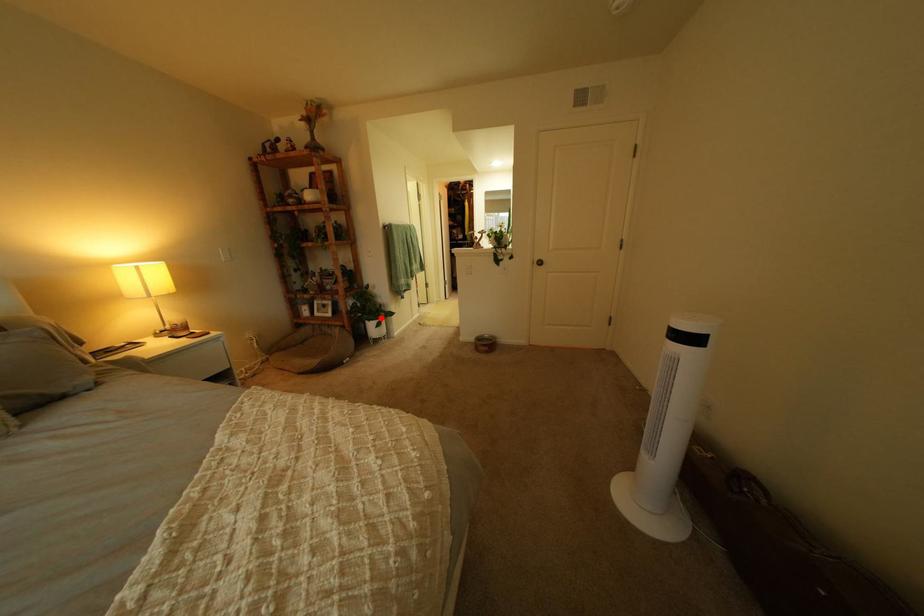
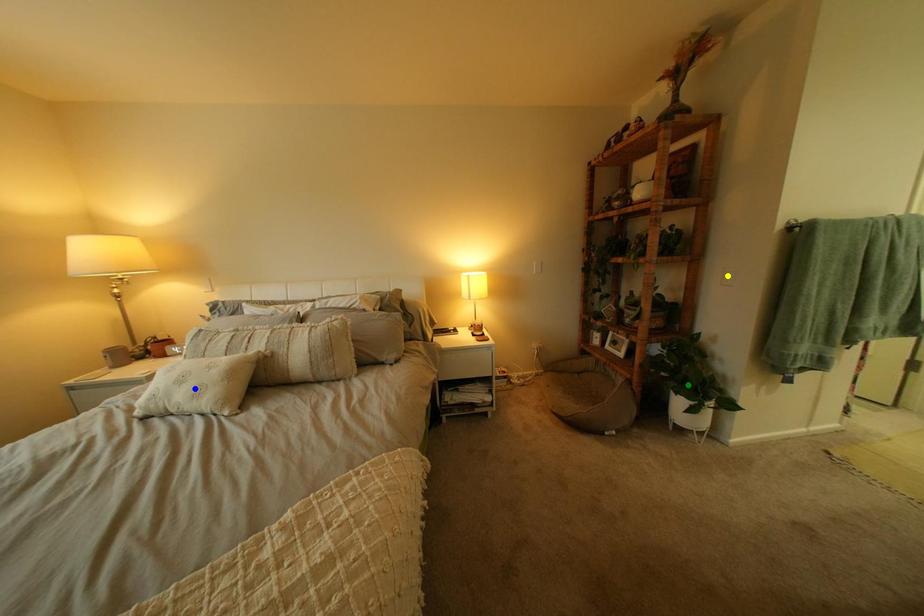
Question: I am providing you with two images of the same scene from different viewpoints. A red point is marked on the first image. You are given multiple points on the second image. In image 2, which mark is for the same physical point as the one in image 1?

Choices:
 (A) yellow point
 (B) blue point
 (C) green point

Answer: (C)